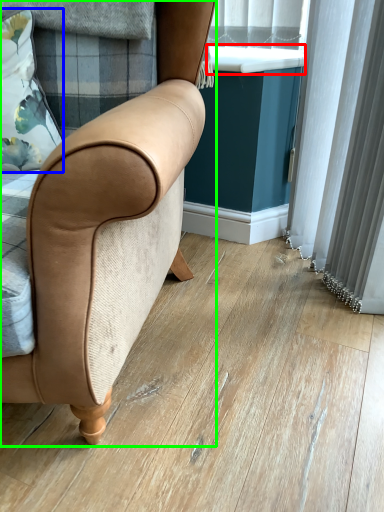
Question: Based on their relative distances, which object is nearer to window sill (highlighted by a red box)? Choose from pillow (highlighted by a blue box) and chair (highlighted by a green box).

Choices:
 (A) pillow
 (B) chair

Answer: (A)